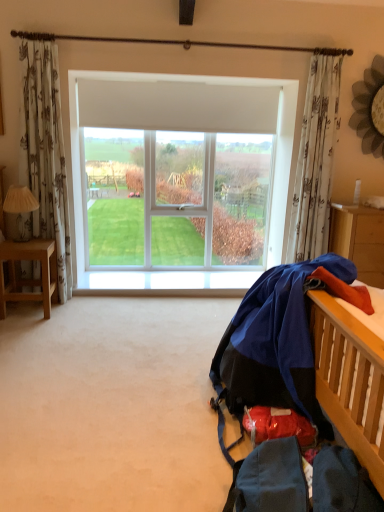
Question: From the image's perspective, does blue fabric at right appear lower than white floral fabric curtain at upper right?

Choices:
 (A) yes
 (B) no

Answer: (A)

Question: Considering the relative sizes of blue fabric at right and white floral fabric curtain at upper right in the image provided, is blue fabric at right thinner than white floral fabric curtain at upper right?

Choices:
 (A) yes
 (B) no

Answer: (B)

Question: From a real-world perspective, does blue fabric at right stand above white floral fabric curtain at upper right?

Choices:
 (A) no
 (B) yes

Answer: (A)

Question: Can you confirm if blue fabric at right is shorter than white floral fabric curtain at upper right?

Choices:
 (A) yes
 (B) no

Answer: (A)

Question: Can you confirm if blue fabric at right is taller than white floral fabric curtain at upper right?

Choices:
 (A) no
 (B) yes

Answer: (A)

Question: Considering the relative positions of blue fabric at right and white floral fabric curtain at upper right in the image provided, is blue fabric at right to the left of white floral fabric curtain at upper right from the viewer's perspective?

Choices:
 (A) yes
 (B) no

Answer: (A)

Question: From a real-world perspective, is white plastic window at center under blue fabric at right?

Choices:
 (A) no
 (B) yes

Answer: (A)

Question: Considering the relative positions of white plastic window at center and blue fabric at right in the image provided, is white plastic window at center to the right of blue fabric at right from the viewer's perspective?

Choices:
 (A) no
 (B) yes

Answer: (A)

Question: Is white plastic window at center outside blue fabric at right?

Choices:
 (A) no
 (B) yes

Answer: (B)

Question: Is white plastic window at center oriented towards blue fabric at right?

Choices:
 (A) yes
 (B) no

Answer: (A)

Question: Can you confirm if white plastic window at center is thinner than blue fabric at right?

Choices:
 (A) no
 (B) yes

Answer: (B)

Question: Is the position of white plastic window at center more distant than that of blue fabric at right?

Choices:
 (A) yes
 (B) no

Answer: (A)

Question: Is white fabric lampshade at left further to camera compared to light brown wooden desk at left?

Choices:
 (A) no
 (B) yes

Answer: (B)